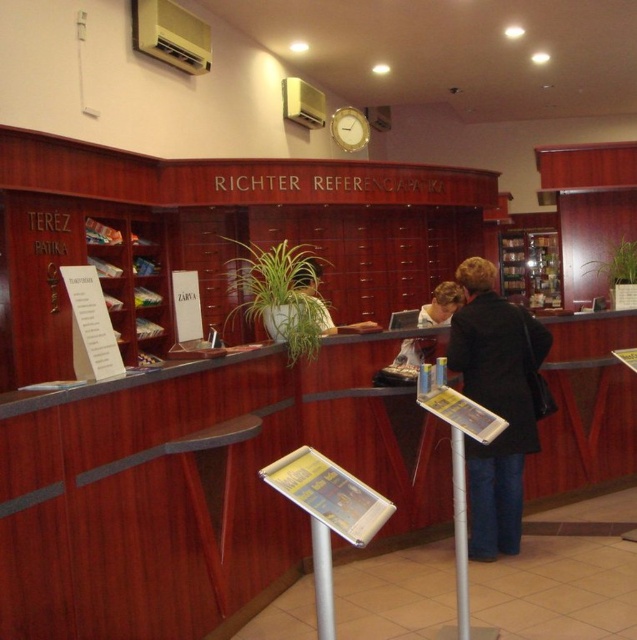
Who is shorter, metallic silver pole at center or silver metallic pole at lower center?

With less height is silver metallic pole at lower center.

How much distance is there between metallic silver pole at center and silver metallic pole at lower center?

metallic silver pole at center and silver metallic pole at lower center are 3.62 feet apart.

Identify the location of metallic silver pole at center. (459, 532).

Who is positioned more to the right, metallic silver pole at center or matte black jacket at center?

Positioned to the right is matte black jacket at center.

Can you confirm if metallic silver pole at center is shorter than matte black jacket at center?

Incorrect, metallic silver pole at center's height does not fall short of matte black jacket at center's.

Which is behind, point (461, 548) or point (408, 340)?

The point (408, 340) is behind.

Where is `metallic silver pole at center`? This screenshot has width=637, height=640. metallic silver pole at center is located at coordinates (459, 532).

Which is above, black matte coat at center or matte black jacket at center?

matte black jacket at center is above.

Does black matte coat at center appear on the left side of matte black jacket at center?

No, black matte coat at center is not to the left of matte black jacket at center.

Which is behind, point (517, 461) or point (404, 364)?

The point (404, 364) is more distant.

Locate an element on the screen. black matte coat at center is located at coordinates click(496, 403).